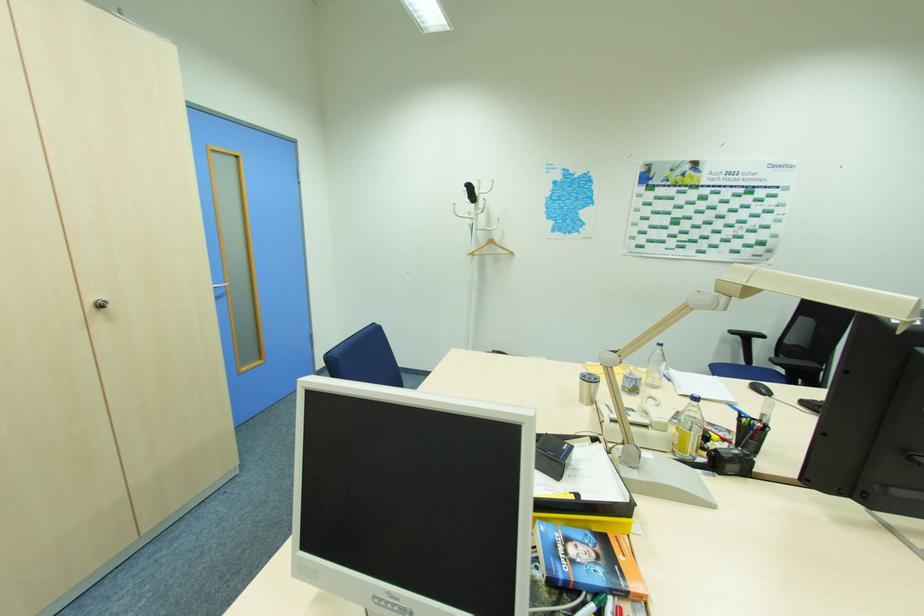
This screenshot has height=616, width=924. Find the location of `chair sitting surface`. chair sitting surface is located at coordinates (781, 359).